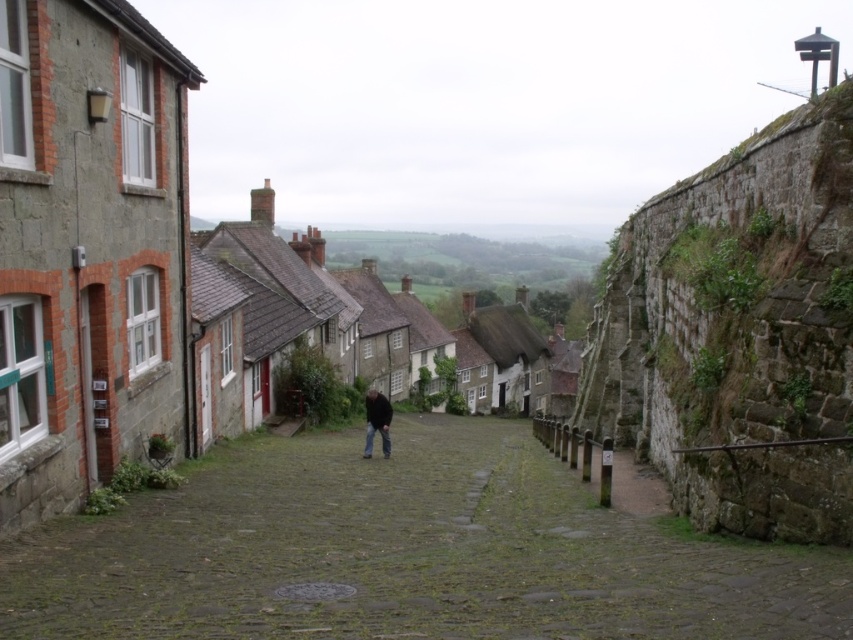
Can you confirm if matte stone village at center is wider than dark brown leather jacket at center?

Indeed, matte stone village at center has a greater width compared to dark brown leather jacket at center.

Who is higher up, matte stone village at center or dark brown leather jacket at center?

matte stone village at center is above.

Who is more distant from viewer, (55, 323) or (387, 422)?

The point (387, 422) is behind.

Locate an element on the screen. matte stone village at center is located at coordinates (125, 264).

Is point (151, 186) farther from camera compared to point (663, 452)?

No.

Does point (97, 208) come in front of point (625, 259)?

Yes, it is.

Is point (99, 476) closer to camera compared to point (817, 417)?

No, (99, 476) is behind (817, 417).

Where is `matte stone village at center`? matte stone village at center is located at coordinates (125, 264).

Can you confirm if rustic stone wall at right is shorter than dark brown leather jacket at center?

No, rustic stone wall at right is not shorter than dark brown leather jacket at center.

Who is more forward, (x=816, y=188) or (x=370, y=454)?

Point (x=816, y=188) is in front.

Describe the element at coordinates (738, 336) in the screenshot. Image resolution: width=853 pixels, height=640 pixels. I see `rustic stone wall at right` at that location.

At what (x,y) coordinates should I click in order to perform the action: click on rustic stone wall at right. Please return your answer as a coordinate pair (x, y). Looking at the image, I should click on (738, 336).